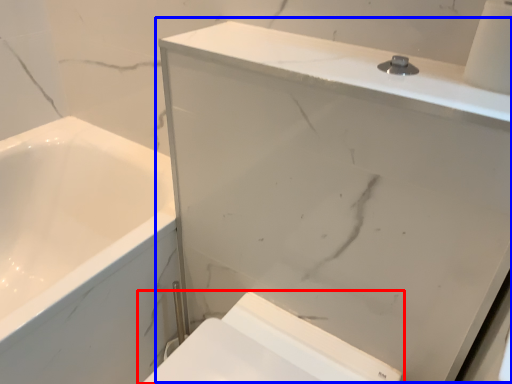
Question: Which of the following is the closest to the observer, toilet (highlighted by a red box) or medicine cabinet (highlighted by a blue box)?

Choices:
 (A) toilet
 (B) medicine cabinet

Answer: (B)